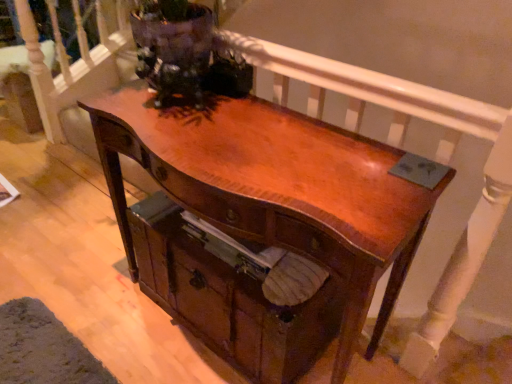
Where is `free space above shiny brown wood desk at center (from a real-world perspective)`? The width and height of the screenshot is (512, 384). free space above shiny brown wood desk at center (from a real-world perspective) is located at coordinates (262, 152).